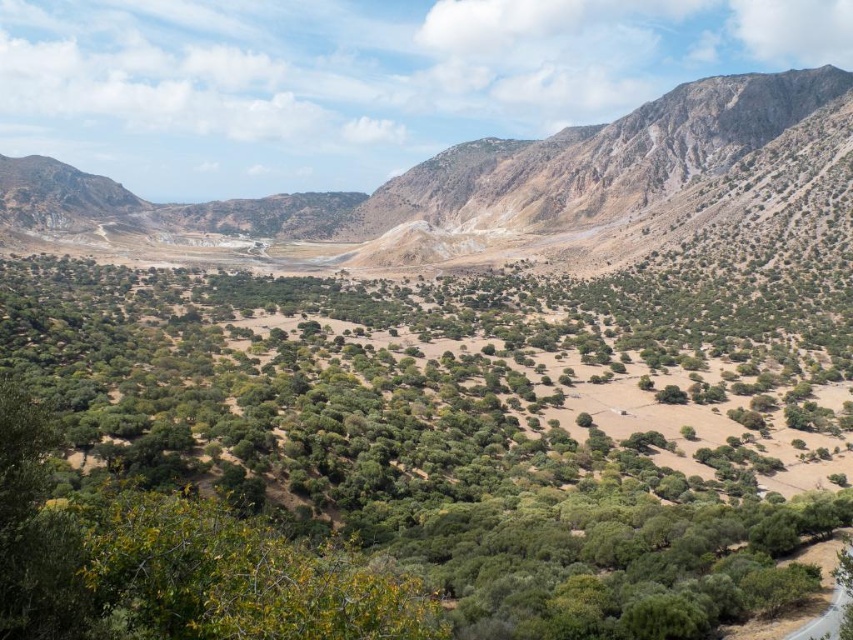
How much distance is there between green leafy trees at center and dull brown rocky mountain at upper right?

green leafy trees at center and dull brown rocky mountain at upper right are 217.87 meters apart from each other.

Who is higher up, green leafy trees at center or dull brown rocky mountain at upper right?

dull brown rocky mountain at upper right is higher up.

What do you see at coordinates (463, 426) in the screenshot? I see `green leafy trees at center` at bounding box center [463, 426].

Locate an element on the screen. The image size is (853, 640). green leafy trees at center is located at coordinates (463, 426).